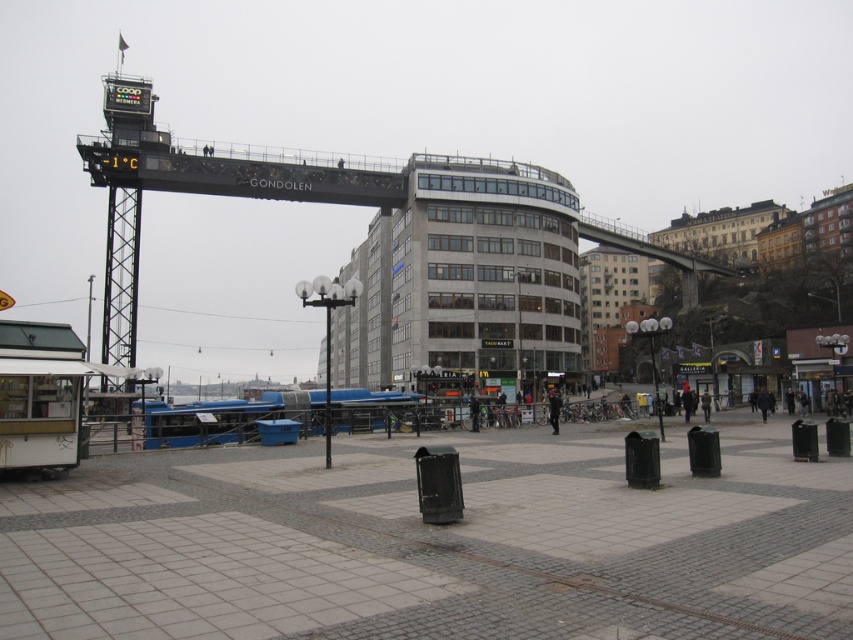
You are standing at the center of the plaza and see the point marked at coordinates (328, 378). Which object is this point located on?

The point at coordinates (328, 378) is located on the metallic pole at center.

You are standing at the center of the plaza and want to locate the metallic pole at center. According to the coordinates provided, in which direction should you move to find it?

The metallic pole at center is located at coordinates point (328, 378), so you should move towards the center of the plaza to find it.